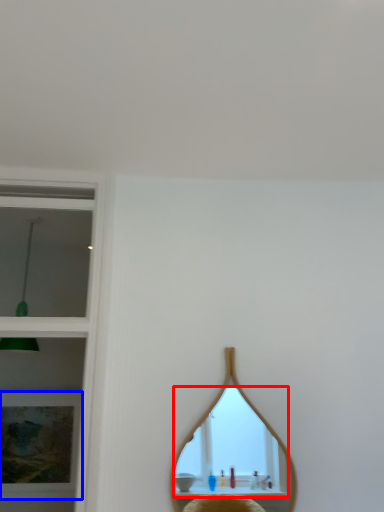
Question: Which object is closer to the camera taking this photo, mirror (highlighted by a red box) or picture frame (highlighted by a blue box)?

Choices:
 (A) mirror
 (B) picture frame

Answer: (A)